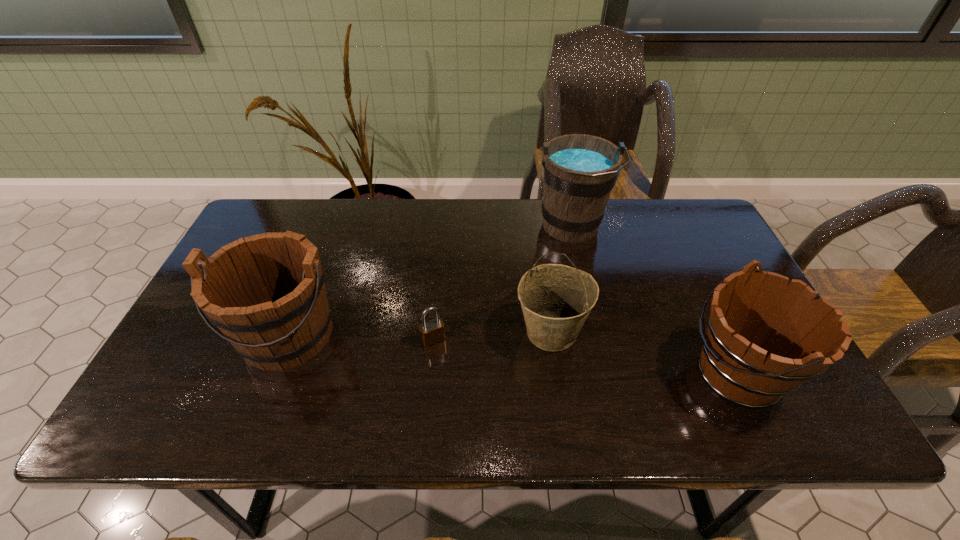
This screenshot has width=960, height=540. Find the location of `the closest wine bucket to the leftmost object`. the closest wine bucket to the leftmost object is located at coordinates (556, 299).

I want to click on free location that satisfies the following two spatial constraints: 1. on the side of the second object from left to right with the handle for carrying; 2. on the left side of the leftmost object, so click(x=286, y=339).